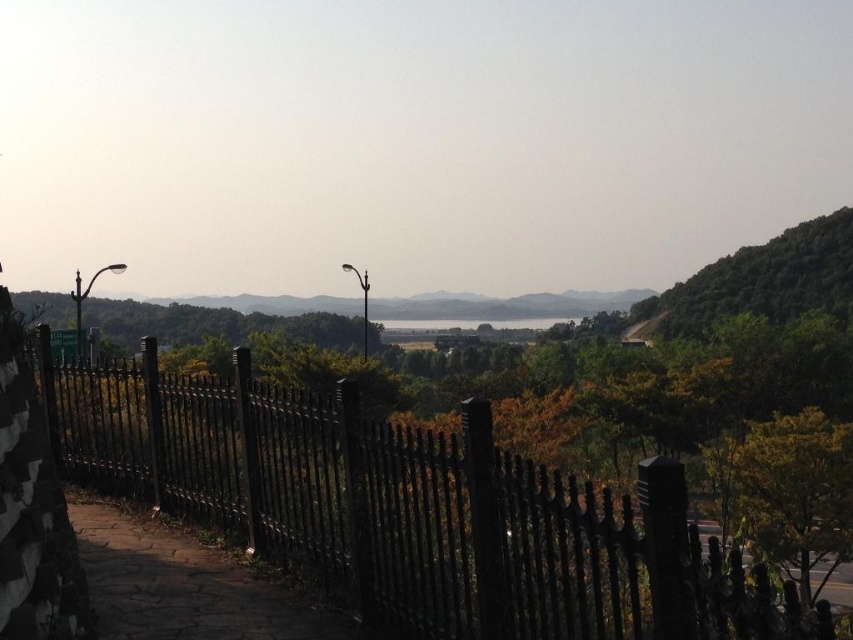
You are standing at the top of the hill and looking down at the landscape. You see two points marked in the image. The first point is at coordinates point (550, 532), and the second point is at point (80, 496). Which of these two points is closer to you?

Point (550, 532) is in front of point (80, 496), so it is closer to you.

You are standing at the top of a hill overlooking the landscape. You notice the black wrought iron fence at center and the brown stone path at lower left. Which object is nearer to you?

The black wrought iron fence at center is closer to the viewer than the brown stone path at lower left.

You are standing at the top of a hill and notice a black wrought iron fence at center in the landscape. If you were to walk directly towards the fence, which direction should you head?

The black wrought iron fence at center is located at coordinates point (410, 509). Since the fence is at the center of the image, you should walk straight ahead to reach it.